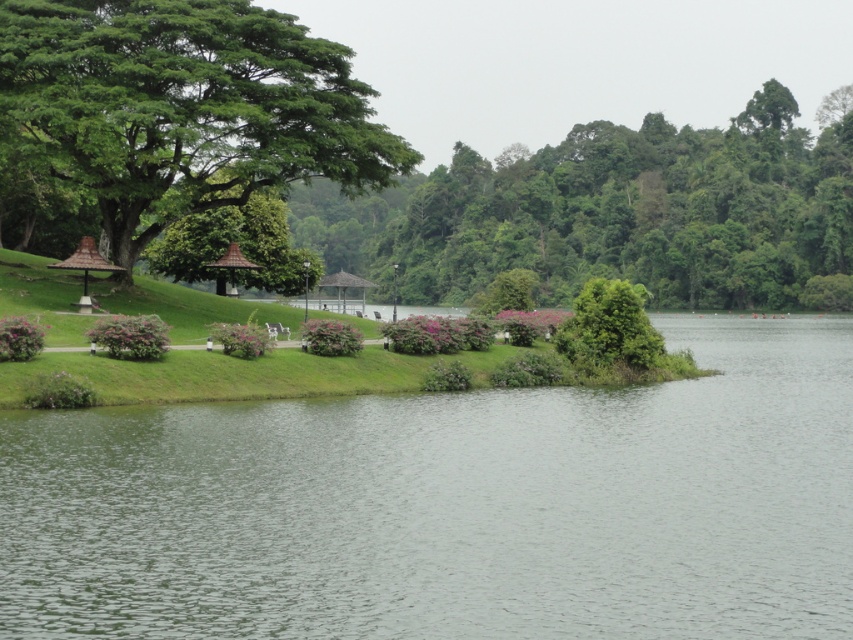
You are planning to set up a picnic blanket under the brown thatched roof gazebo at center. However, you notice the clear water at center is already occupying that space. Can you place your picnic blanket there without disturbing the water?

The clear water at center is positioned under the brown thatched roof gazebo at center, so you cannot place your picnic blanket there without disturbing the water.

You are planning to take a photo of the clear water at center and the brown thatched roof gazebo at left. Which object should you focus on first if you want to capture both in one frame without moving the camera?

You should focus on the clear water at center first because it is larger in size compared to the brown thatched roof gazebo at left, allowing it to be more prominent in the frame.

You are planning to place a small boat in the scene. The boat requires a water area wider than the green leafy tree at upper left to navigate safely. Can the clear water at center accommodate this requirement?

The clear water at center might be wider than the green leafy tree at upper left, so it could potentially accommodate the boat.